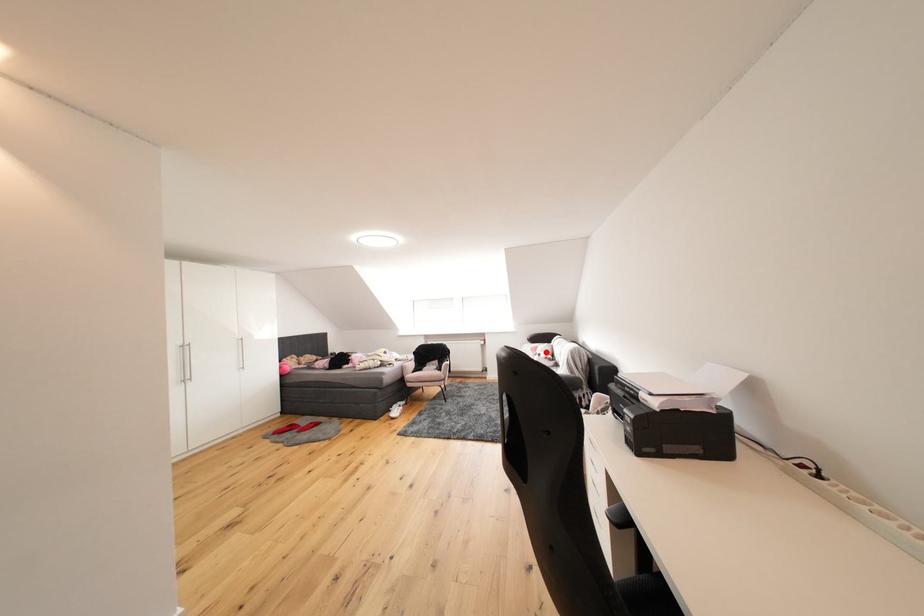
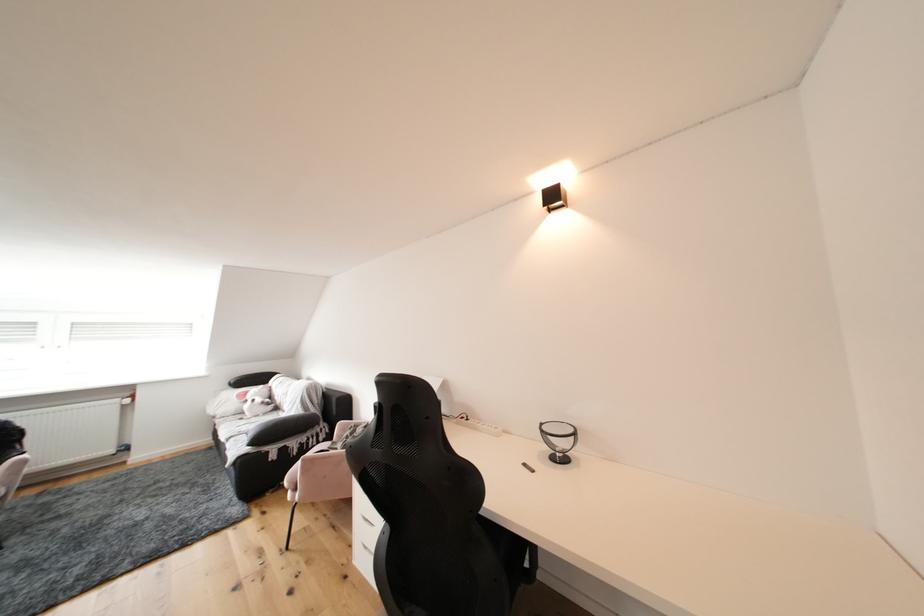
In the second image, find the point that corresponds to the highlighted location in the first image.

(256, 397)